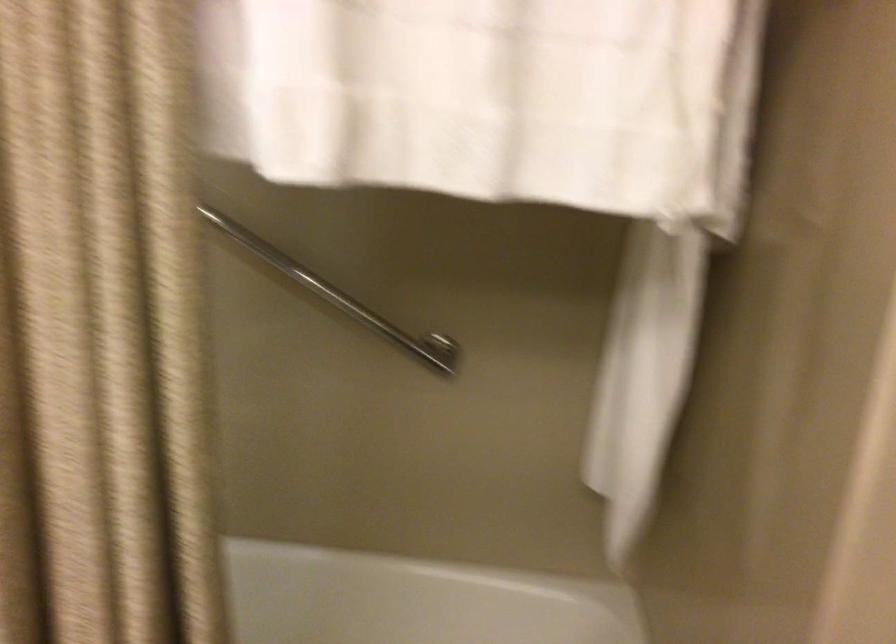
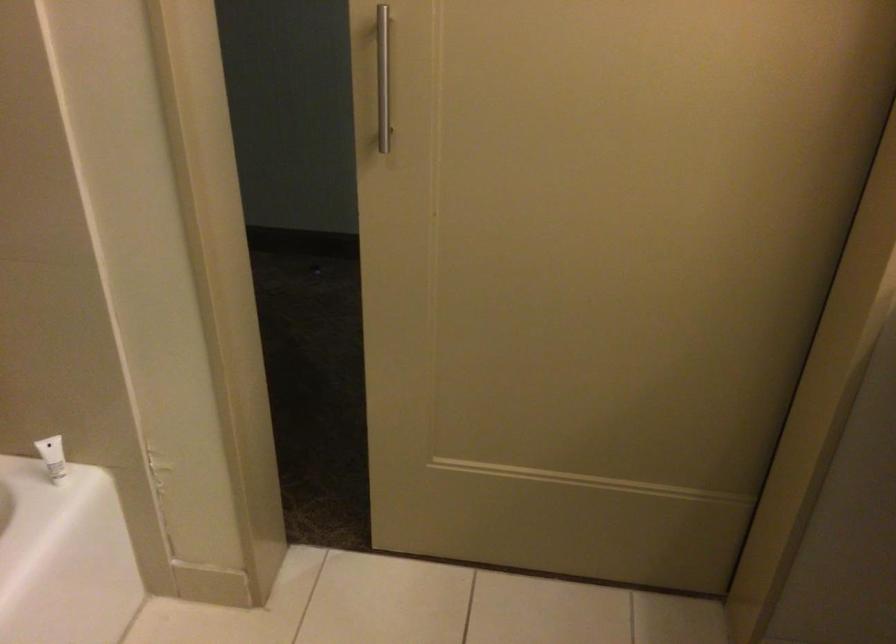
Based on the continuous images, in which direction is the camera rotating?

The rotation direction of the camera is right-down.